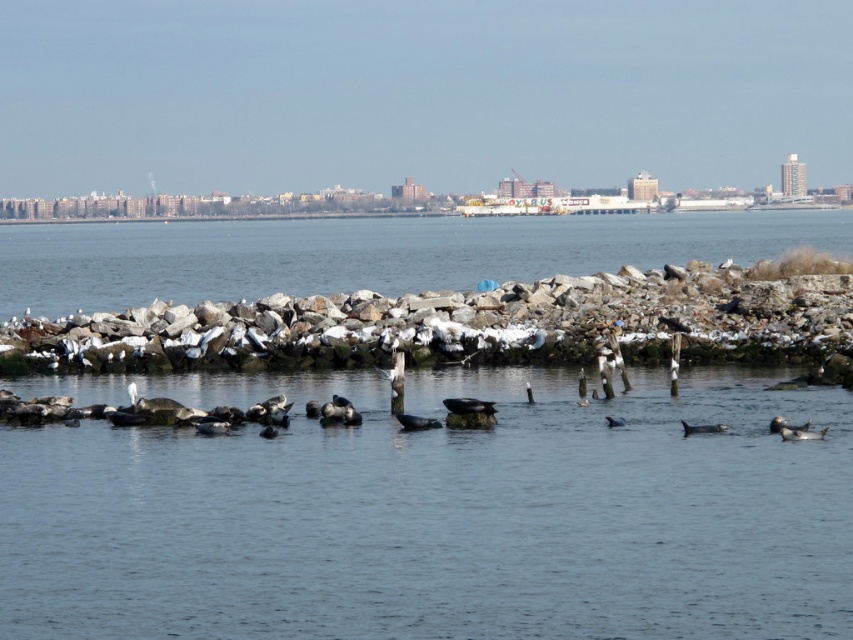
Question: Can you confirm if grayish-blue water at center is thinner than clear water at center?

Choices:
 (A) no
 (B) yes

Answer: (B)

Question: Which object appears farthest from the camera in this image?

Choices:
 (A) clear water at center
 (B) grayish-blue water at center

Answer: (A)

Question: Which point appears closest to the camera in this image?

Choices:
 (A) (231, 282)
 (B) (210, 483)

Answer: (B)

Question: Which of the following is the closest to the observer?

Choices:
 (A) (206, 266)
 (B) (543, 550)

Answer: (B)

Question: Is grayish-blue water at center wider than clear water at center?

Choices:
 (A) yes
 (B) no

Answer: (B)

Question: Does grayish-blue water at center appear on the right side of clear water at center?

Choices:
 (A) no
 (B) yes

Answer: (B)